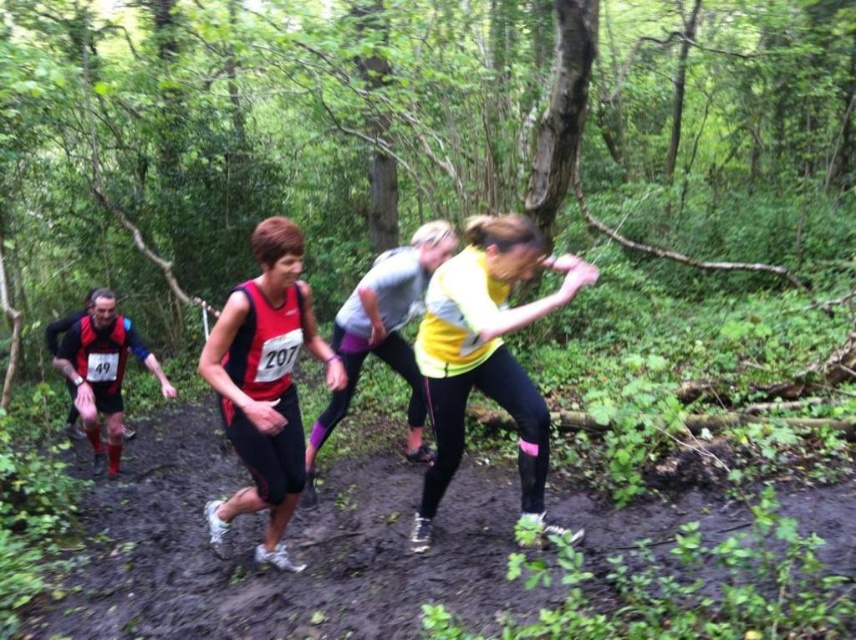
Based on the scene description, which runner is closer to the camera, the matte red tank top at center or the yellow fabric running suit at center?

The matte red tank top at center is closer to the camera because it is in front of the yellow fabric running suit at center.

You are a photographer positioned at the starting line of the trail run. You want to capture a photo of the matte red tank top at center and the yellow fabric running suit at center. Which runner should you focus on first if you want to photograph them in the order from left to right?

The matte red tank top at center is to the left of the yellow fabric running suit at center, so you should focus on the matte red tank top at center first to capture them from left to right.